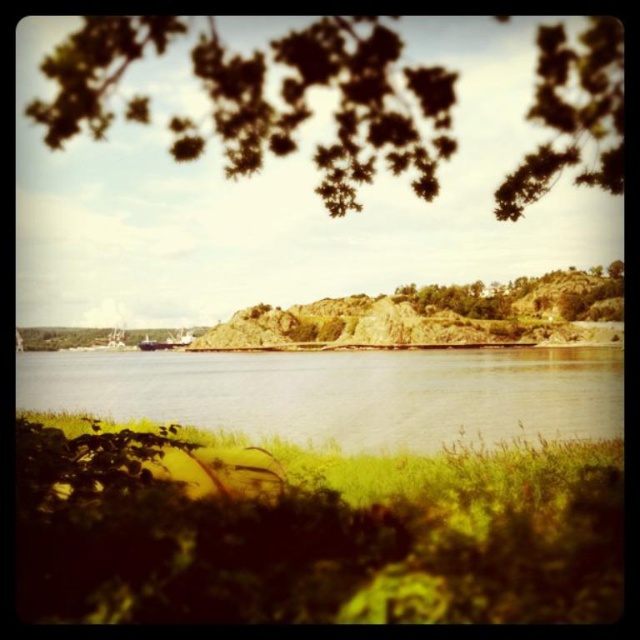
Does clear water at center appear on the left side of green grass at lower center?

No, clear water at center is not to the left of green grass at lower center.

Does clear water at center appear under green grass at lower center?

Incorrect, clear water at center is not positioned below green grass at lower center.

Where is `clear water at center`? clear water at center is located at coordinates tap(342, 394).

This screenshot has width=640, height=640. I want to click on clear water at center, so (342, 394).

Does clear water at center appear on the right side of green rough textured rock at center?

No, clear water at center is not to the right of green rough textured rock at center.

Is point (486, 438) closer to camera compared to point (618, 269)?

Yes, it is.

The width and height of the screenshot is (640, 640). In order to click on clear water at center in this screenshot , I will do `click(342, 394)`.

Can you confirm if dark green leaves at upper center is bigger than clear water at center?

Correct, dark green leaves at upper center is larger in size than clear water at center.

Is dark green leaves at upper center smaller than clear water at center?

Actually, dark green leaves at upper center might be larger than clear water at center.

At what (x,y) coordinates should I click in order to perform the action: click on dark green leaves at upper center. Please return your answer as a coordinate pair (x, y). Image resolution: width=640 pixels, height=640 pixels. Looking at the image, I should click on (337, 106).